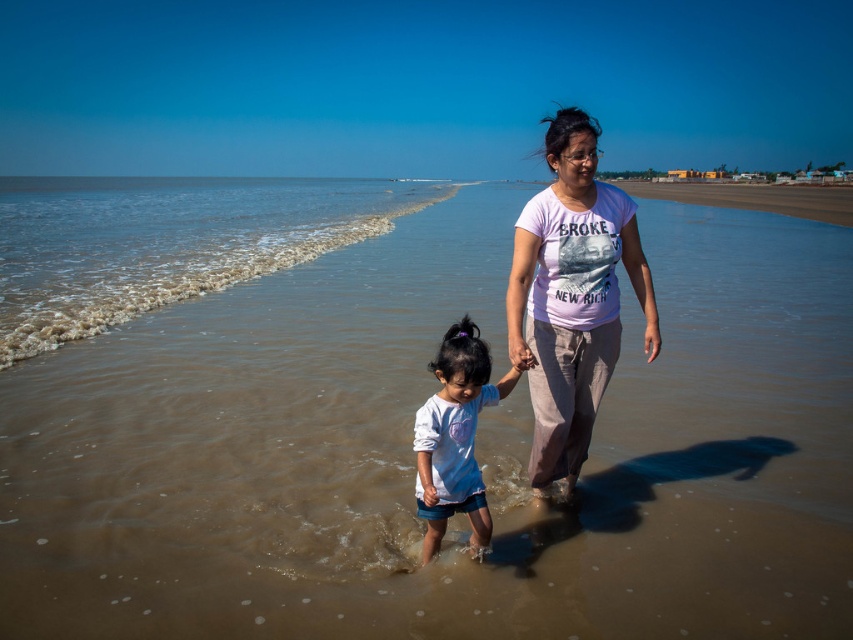
Question: Which point is farther to the camera?

Choices:
 (A) white cotton shirt at center
 (B) brown sand at lower center
 (C) white cotton t-shirt at center
 (D) brown sand at lower left

Answer: (D)

Question: Which of the following is the farthest from the observer?

Choices:
 (A) (746, 483)
 (B) (219, 209)
 (C) (469, 518)
 (D) (518, 342)

Answer: (B)

Question: Among these points, which one is farthest from the camera?

Choices:
 (A) (532, 364)
 (B) (184, 285)
 (C) (287, 355)
 (D) (469, 412)

Answer: (B)

Question: Does white cotton t-shirt at center have a lesser width compared to white cotton shirt at center?

Choices:
 (A) yes
 (B) no

Answer: (A)

Question: Does brown sand at lower center have a lesser width compared to white cotton t-shirt at center?

Choices:
 (A) no
 (B) yes

Answer: (A)

Question: Is brown sand at lower center positioned before white cotton t-shirt at center?

Choices:
 (A) no
 (B) yes

Answer: (A)